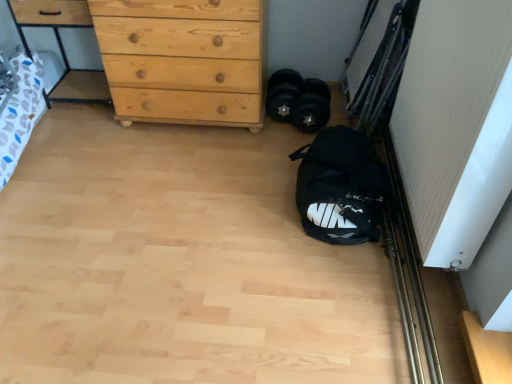
Question: Does natural wood chest of drawers at upper left have a lesser height compared to natural wood dresser at upper left?

Choices:
 (A) no
 (B) yes

Answer: (A)

Question: From the image's perspective, does natural wood chest of drawers at upper left appear lower than natural wood dresser at upper left?

Choices:
 (A) no
 (B) yes

Answer: (B)

Question: Is natural wood chest of drawers at upper left oriented towards natural wood dresser at upper left?

Choices:
 (A) yes
 (B) no

Answer: (B)

Question: Is natural wood chest of drawers at upper left wider than natural wood dresser at upper left?

Choices:
 (A) yes
 (B) no

Answer: (A)

Question: Can we say natural wood chest of drawers at upper left lies outside natural wood dresser at upper left?

Choices:
 (A) no
 (B) yes

Answer: (B)

Question: Is black rubber dumbbells at center in front of or behind white textured screen door at right in the image?

Choices:
 (A) behind
 (B) front

Answer: (A)

Question: Is black rubber dumbbells at center situated inside white textured screen door at right or outside?

Choices:
 (A) inside
 (B) outside

Answer: (B)

Question: From their relative heights in the image, would you say black rubber dumbbells at center is taller or shorter than white textured screen door at right?

Choices:
 (A) tall
 (B) short

Answer: (B)

Question: Based on their sizes in the image, would you say black rubber dumbbells at center is bigger or smaller than white textured screen door at right?

Choices:
 (A) small
 (B) big

Answer: (A)

Question: Visually, is natural wood dresser at upper left positioned to the left or to the right of white textured screen door at right?

Choices:
 (A) right
 (B) left

Answer: (B)

Question: Is natural wood dresser at upper left inside the boundaries of white textured screen door at right, or outside?

Choices:
 (A) outside
 (B) inside

Answer: (A)

Question: Is natural wood dresser at upper left wider or thinner than white textured screen door at right?

Choices:
 (A) wide
 (B) thin

Answer: (A)

Question: Does point (53, 23) appear closer or farther from the camera than point (466, 193)?

Choices:
 (A) closer
 (B) farther

Answer: (B)

Question: From the image's perspective, is white textured screen door at right located above or below natural wood chest of drawers at upper left?

Choices:
 (A) below
 (B) above

Answer: (A)

Question: Is white textured screen door at right situated inside natural wood chest of drawers at upper left or outside?

Choices:
 (A) outside
 (B) inside

Answer: (A)